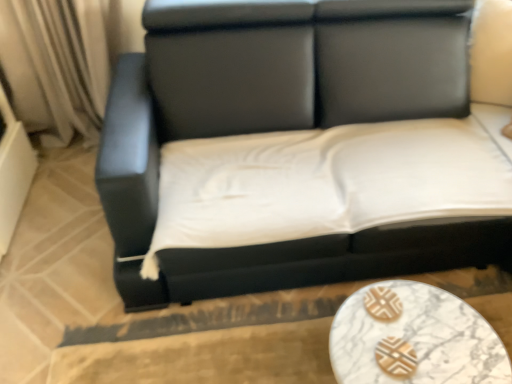
The image size is (512, 384). Identify the location of empty space that is ontop of white marble table at lower center (from a real-world perspective). (409, 335).